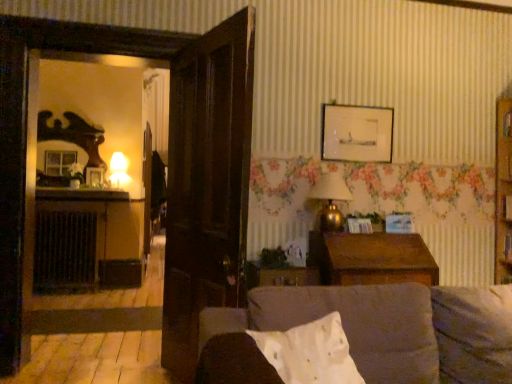
Measure the distance between brown wooden table at center and camera.

brown wooden table at center and camera are 8.54 feet apart from each other.

Locate an element on the screen. brown wooden table at center is located at coordinates [x=371, y=259].

Describe the element at coordinates (119, 171) in the screenshot. I see `matte glass lamp at left, the 2th lamp from the front` at that location.

The height and width of the screenshot is (384, 512). What do you see at coordinates (395, 328) in the screenshot? I see `velvet brown couch at center` at bounding box center [395, 328].

The height and width of the screenshot is (384, 512). What do you see at coordinates (94, 177) in the screenshot?
I see `matte glass picture frame at left, which appears as the first picture frame when viewed from the back` at bounding box center [94, 177].

What is the approximate width of matte glass picture frame at left, the first picture frame positioned from the left?

matte glass picture frame at left, the first picture frame positioned from the left, is 2.49 inches wide.

Find the location of a particular element. The height and width of the screenshot is (384, 512). wooden picture frame at upper center, the first picture frame positioned from the front is located at coordinates (357, 133).

Considering the positions of objects matte glass picture frame at left, which is the second picture frame from right to left, and white cotton pillow at center in the image provided, who is more to the right, matte glass picture frame at left, which is the second picture frame from right to left, or white cotton pillow at center?

Positioned to the right is white cotton pillow at center.

Which of these two, matte glass picture frame at left, the first picture frame positioned from the left, or white cotton pillow at center, is bigger?

Bigger between the two is white cotton pillow at center.

Does point (85, 179) come behind point (328, 316)?

Yes.

Looking at this image, from the image's perspective, is matte glass lamp at left, placed as the 2th lamp when sorted from right to left, on top of velvet brown couch at center?

Yes, from the image's perspective, matte glass lamp at left, placed as the 2th lamp when sorted from right to left, is over velvet brown couch at center.

Is matte glass lamp at left, which ranks as the 1th lamp in left-to-right order, smaller than velvet brown couch at center?

Yes, matte glass lamp at left, which ranks as the 1th lamp in left-to-right order, is smaller than velvet brown couch at center.

Is matte glass lamp at left, the 2th lamp from the front, aimed at velvet brown couch at center?

No, matte glass lamp at left, the 2th lamp from the front, is not aimed at velvet brown couch at center.

From a real-world perspective, does matte glass lamp at left, which ranks as the 1th lamp in left-to-right order, sit lower than velvet brown couch at center?

Incorrect, from a real-world perspective, matte glass lamp at left, which ranks as the 1th lamp in left-to-right order, is higher than velvet brown couch at center.

Is velvet brown couch at center facing away from matte glass lamp at left, acting as the first lamp starting from the back?

Yes, velvet brown couch at center's orientation is away from matte glass lamp at left, acting as the first lamp starting from the back.

Looking at this image, from the image's perspective, is velvet brown couch at center below matte glass lamp at left, the 2th lamp from the front?

Correct, velvet brown couch at center appears lower than matte glass lamp at left, the 2th lamp from the front, in the image.

What's the angular difference between velvet brown couch at center and matte glass lamp at left, acting as the first lamp starting from the back,'s facing directions?

1.38 degrees.

Is velvet brown couch at center wider than matte glass lamp at left, the 2th lamp from the front?

Yes, velvet brown couch at center is wider than matte glass lamp at left, the 2th lamp from the front.

Does white cotton pillow at center have a greater height compared to matte glass lamp at left, placed as the 2th lamp when sorted from right to left?

Incorrect, the height of white cotton pillow at center is not larger of that of matte glass lamp at left, placed as the 2th lamp when sorted from right to left.

Is white cotton pillow at center smaller than matte glass lamp at left, acting as the first lamp starting from the back?

Actually, white cotton pillow at center might be larger than matte glass lamp at left, acting as the first lamp starting from the back.

At what (x,y) coordinates should I click in order to perform the action: click on pillow below the matte glass lamp at left, placed as the 2th lamp when sorted from right to left (from a real-world perspective). Please return your answer as a coordinate pair (x, y). Looking at the image, I should click on (310, 352).

Is brown wooden table at center not within gold metallic lamp at upper right, which is the 1th lamp from bottom to top?

Indeed, brown wooden table at center is completely outside gold metallic lamp at upper right, which is the 1th lamp from bottom to top.

From a real-world perspective, is brown wooden table at center below gold metallic lamp at upper right, marked as the 1th lamp in a right-to-left arrangement?

Indeed, from a real-world perspective, brown wooden table at center is positioned beneath gold metallic lamp at upper right, marked as the 1th lamp in a right-to-left arrangement.

Who is more distant, brown wooden table at center or gold metallic lamp at upper right, positioned as the 2th lamp in top-to-bottom order?

gold metallic lamp at upper right, positioned as the 2th lamp in top-to-bottom order, is behind.

Is point (412, 254) farther from viewer compared to point (324, 219)?

No, it is in front of (324, 219).

The height and width of the screenshot is (384, 512). Find the location of `pillow on the right of black metal radiator at left`. pillow on the right of black metal radiator at left is located at coordinates (310, 352).

Looking at this image, is black metal radiator at left completely or partially inside white cotton pillow at center?

Actually, black metal radiator at left is outside white cotton pillow at center.

Between white cotton pillow at center and black metal radiator at left, which one has smaller width?

Thinner between the two is black metal radiator at left.

Is velvet brown couch at center shorter than brown wooden table at center?

No.

From a real-world perspective, is velvet brown couch at center above or below brown wooden table at center?

Clearly, from a real-world perspective, velvet brown couch at center is below brown wooden table at center.

Is velvet brown couch at center in front of brown wooden table at center?

Yes.

Which is behind, point (405, 321) or point (380, 237)?

Point (380, 237)

Image resolution: width=512 pixels, height=384 pixels. In order to click on picture frame to the left of white cotton pillow at center in this screenshot , I will do `click(94, 177)`.

From the image's perspective, starting from the velvet brown couch at center, which lamp is the 2nd one above? Please provide its 2D coordinates.

[(119, 171)]

Based on their spatial positions, is gold metallic lamp at upper right, positioned as the 2th lamp in top-to-bottom order, or matte glass lamp at left, placed as the second lamp when sorted from bottom to top, further from wooden picture frame at upper center, the first picture frame positioned from the front?

Based on the image, matte glass lamp at left, placed as the second lamp when sorted from bottom to top, appears to be further to wooden picture frame at upper center, the first picture frame positioned from the front.

From the image, which object appears to be nearer to black metal radiator at left, wooden picture frame at upper center, positioned as the 2th picture frame in back-to-front order, or gold metallic lamp at upper right, positioned as the 2th lamp in top-to-bottom order?

gold metallic lamp at upper right, positioned as the 2th lamp in top-to-bottom order.

Consider the image. When comparing their distances from matte glass lamp at left, the 2th lamp from the front, does velvet brown couch at center or brown wooden table at center seem further?

Among the two, velvet brown couch at center is located further to matte glass lamp at left, the 2th lamp from the front.

Estimate the real-world distances between objects in this image. Which object is closer to velvet brown couch at center, brown wooden table at center or gold metallic lamp at upper right, positioned as the 2th lamp in top-to-bottom order?

Among the two, brown wooden table at center is located nearer to velvet brown couch at center.

Estimate the real-world distances between objects in this image. Which object is closer to black metal radiator at left, white cotton pillow at center or matte glass lamp at left, acting as the first lamp starting from the back?

matte glass lamp at left, acting as the first lamp starting from the back, lies closer to black metal radiator at left than the other object.

Based on their spatial positions, is gold metallic lamp at upper right, which is the 1th lamp from bottom to top, or black metal radiator at left further from matte glass lamp at left, placed as the first lamp when sorted from top to bottom?

gold metallic lamp at upper right, which is the 1th lamp from bottom to top, lies further to matte glass lamp at left, placed as the first lamp when sorted from top to bottom, than the other object.

Considering their positions, is gold metallic lamp at upper right, the first lamp when ordered from front to back, positioned further to white cotton pillow at center than matte glass picture frame at left, which is the second picture frame from top to bottom?

matte glass picture frame at left, which is the second picture frame from top to bottom.

Based on their spatial positions, is wooden picture frame at upper center, the first picture frame when ordered from right to left, or brown wooden table at center further from velvet brown couch at center?

wooden picture frame at upper center, the first picture frame when ordered from right to left, is further to velvet brown couch at center.

This screenshot has width=512, height=384. What are the coordinates of `lamp located between velvet brown couch at center and wooden picture frame at upper center, the first picture frame positioned from the front, in the depth direction` in the screenshot? It's located at (330, 200).

At what (x,y) coordinates should I click in order to perform the action: click on table between velvet brown couch at center and wooden picture frame at upper center, the first picture frame positioned from the front, from front to back. Please return your answer as a coordinate pair (x, y). This screenshot has height=384, width=512. Looking at the image, I should click on (371, 259).

Where is `table between velvet brown couch at center and gold metallic lamp at upper right, the first lamp when ordered from front to back, along the z-axis`? table between velvet brown couch at center and gold metallic lamp at upper right, the first lamp when ordered from front to back, along the z-axis is located at coordinates (371, 259).

Find the location of a particular element. picture frame situated between matte glass lamp at left, placed as the second lamp when sorted from bottom to top, and brown wooden table at center from left to right is located at coordinates (357, 133).